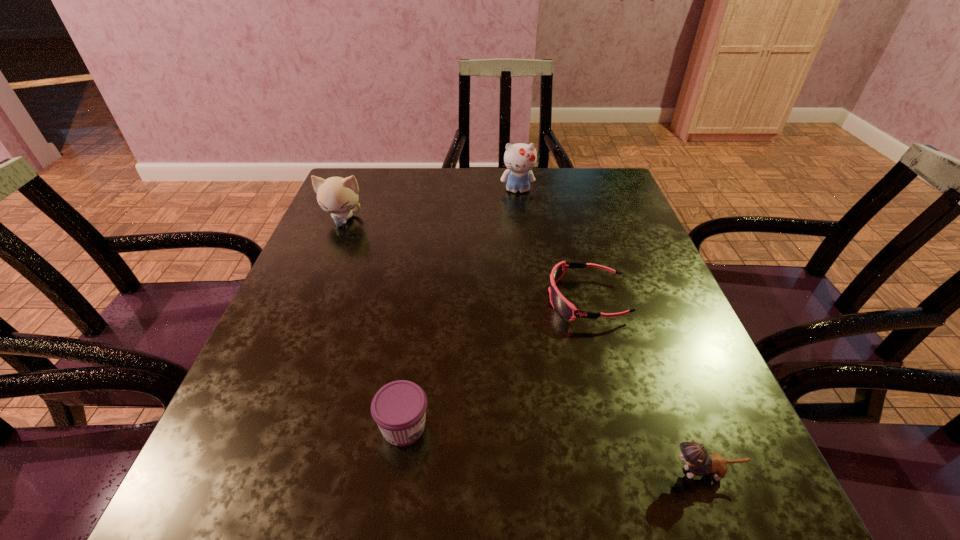
The image size is (960, 540). What are the coordinates of `object present at the left edge` in the screenshot? It's located at tap(336, 195).

This screenshot has width=960, height=540. Identify the location of kitten located in the right edge section of the desktop. (699, 463).

I want to click on goggles located in the right edge section of the desktop, so click(x=562, y=306).

Where is `object positioned at the far left corner`? This screenshot has height=540, width=960. object positioned at the far left corner is located at coordinates (336, 195).

Where is `object located at the near right corner`? This screenshot has height=540, width=960. object located at the near right corner is located at coordinates (699, 463).

In the image, there is a desktop. Find the location of `free space at the far edge`. free space at the far edge is located at coordinates (499, 192).

Find the location of a particular element. The image size is (960, 540). free space at the left edge is located at coordinates (365, 291).

Identify the location of vacant space at the right edge of the desktop. This screenshot has height=540, width=960. (732, 422).

Identify the location of free space at the far left corner of the desktop. The width and height of the screenshot is (960, 540). (x=388, y=174).

Locate an element on the screen. This screenshot has width=960, height=540. vacant space at the near left corner of the desktop is located at coordinates (200, 516).